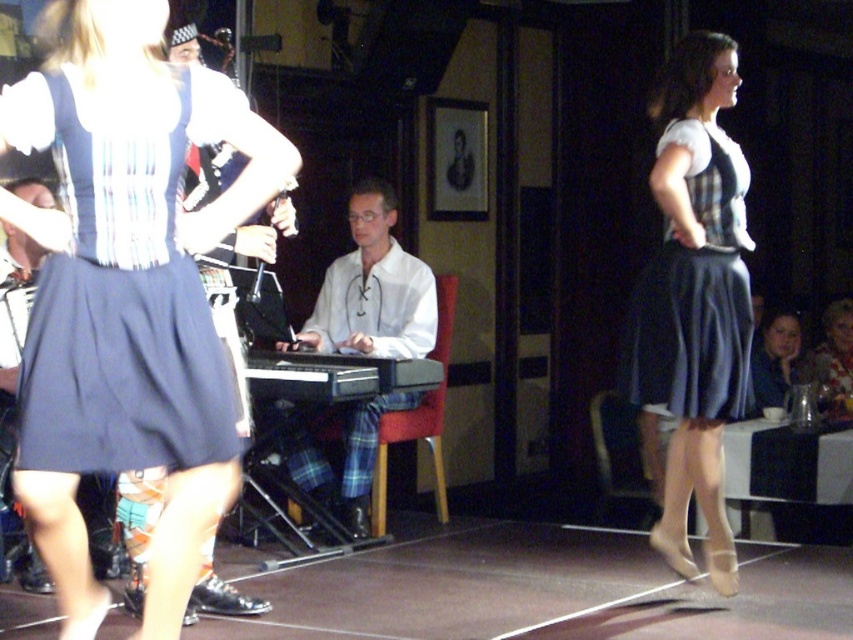
Question: Does matte black dress at right appear on the right side of matte black hair at upper right?

Choices:
 (A) no
 (B) yes

Answer: (A)

Question: Which object appears farthest from the camera in this image?

Choices:
 (A) matte blue skirt at left
 (B) white lace-up shirt at center

Answer: (B)

Question: Can you confirm if black plastic keyboard at center is thinner than floral fabric dress at right?

Choices:
 (A) yes
 (B) no

Answer: (B)

Question: Which of the following is the closest to the observer?

Choices:
 (A) (668, 381)
 (B) (376, 344)
 (C) (375, 378)

Answer: (A)

Question: Which object is farther from the camera taking this photo?

Choices:
 (A) matte blue skirt at left
 (B) matte black dress at right
 (C) matte black hair at upper right

Answer: (C)

Question: Does matte blue skirt at left have a larger size compared to floral fabric dress at right?

Choices:
 (A) no
 (B) yes

Answer: (A)